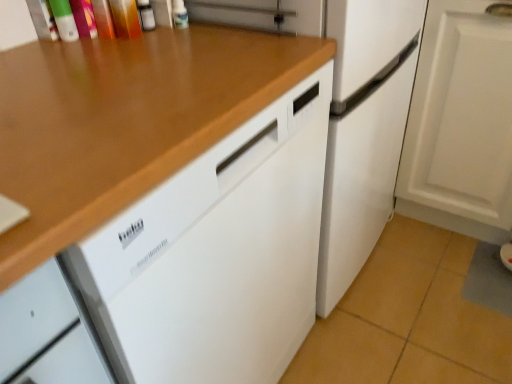
Question: From the image's perspective, is wooden at upper left located above or below white matte refrigerator at center?

Choices:
 (A) above
 (B) below

Answer: (B)

Question: Does point (163, 122) appear closer or farther from the camera than point (336, 296)?

Choices:
 (A) farther
 (B) closer

Answer: (B)

Question: Estimate the real-world distances between objects in this image. Which object is closer to the wooden at upper left?

Choices:
 (A) white matte refrigerator at center
 (B) white matte cabinet at lower right

Answer: (A)

Question: Based on their relative distances, which object is nearer to the white matte cabinet at lower right?

Choices:
 (A) white matte refrigerator at center
 (B) wooden at upper left

Answer: (A)